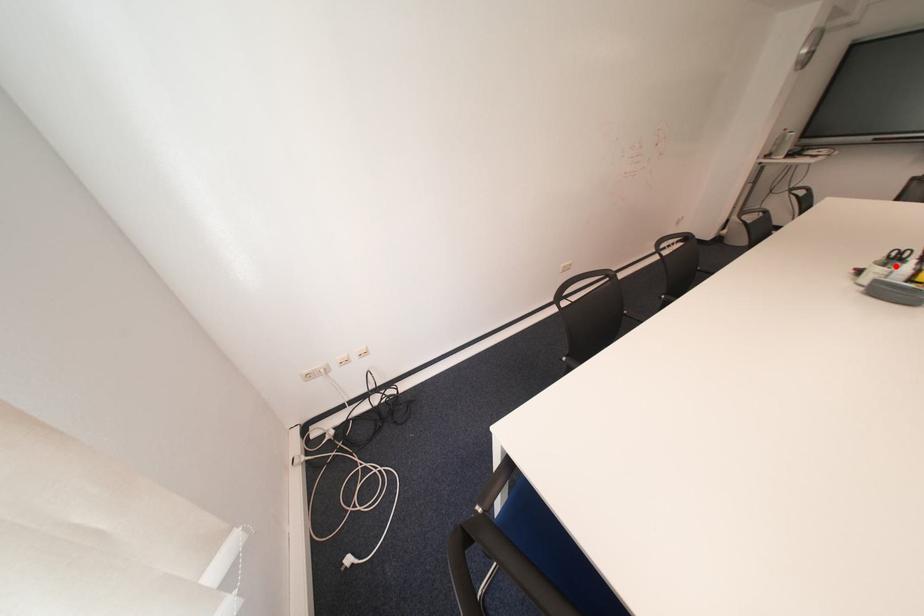
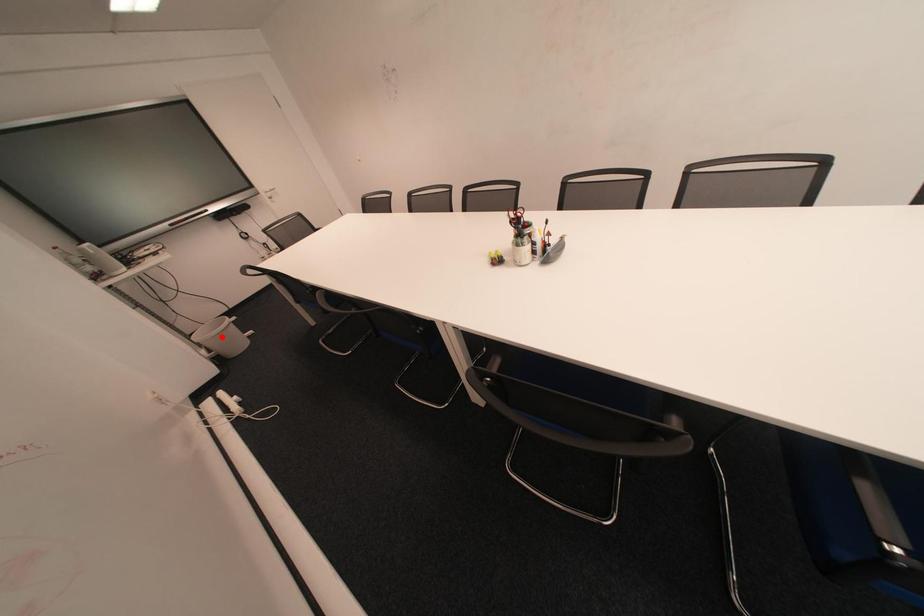
From the picture: I am providing you with two images of the same scene from different viewpoints. A red point is marked on the first image and another point is marked on the second image. Is the marked point in image1 the same physical position as the marked point in image2?

No